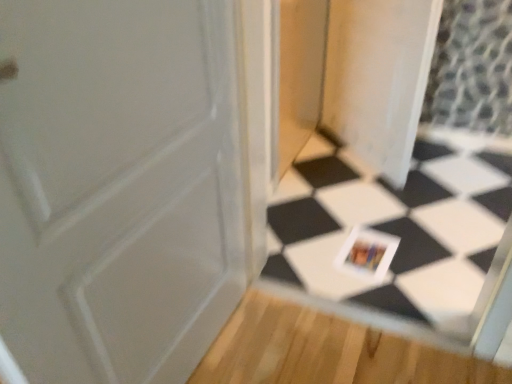
Question: Is transparent plastic screen door at center beside white glossy tile at center?

Choices:
 (A) yes
 (B) no

Answer: (B)

Question: Does transparent plastic screen door at center lie behind white glossy tile at center?

Choices:
 (A) no
 (B) yes

Answer: (B)

Question: Considering the relative sizes of transparent plastic screen door at center and white glossy tile at center in the image provided, is transparent plastic screen door at center wider than white glossy tile at center?

Choices:
 (A) yes
 (B) no

Answer: (B)

Question: Considering the relative sizes of transparent plastic screen door at center and white glossy tile at center in the image provided, is transparent plastic screen door at center thinner than white glossy tile at center?

Choices:
 (A) yes
 (B) no

Answer: (A)

Question: Is transparent plastic screen door at center positioned with its back to white glossy tile at center?

Choices:
 (A) no
 (B) yes

Answer: (A)

Question: Visually, is white glossy tile at center positioned to the left or to the right of transparent plastic screen door at center?

Choices:
 (A) left
 (B) right

Answer: (A)

Question: Is white glossy tile at center wider or thinner than transparent plastic screen door at center?

Choices:
 (A) wide
 (B) thin

Answer: (A)

Question: Is white glossy tile at center spatially inside transparent plastic screen door at center, or outside of it?

Choices:
 (A) outside
 (B) inside

Answer: (A)

Question: From a real-world perspective, relative to transparent plastic screen door at center, is white glossy tile at center vertically above or below?

Choices:
 (A) above
 (B) below

Answer: (A)

Question: In the image, is white glossy tile at center positioned in front of or behind white glossy postcard at center?

Choices:
 (A) behind
 (B) front

Answer: (B)

Question: Considering the positions of white glossy tile at center and white glossy postcard at center in the image, is white glossy tile at center taller or shorter than white glossy postcard at center?

Choices:
 (A) short
 (B) tall

Answer: (B)

Question: Looking at their shapes, would you say white glossy tile at center is wider or thinner than white glossy postcard at center?

Choices:
 (A) thin
 (B) wide

Answer: (A)

Question: Would you say white glossy tile at center is to the left or to the right of white glossy postcard at center in the picture?

Choices:
 (A) left
 (B) right

Answer: (A)

Question: From a real-world perspective, is transparent plastic screen door at center physically located above or below white glossy postcard at center?

Choices:
 (A) above
 (B) below

Answer: (A)

Question: Is point (399, 71) positioned closer to the camera than point (378, 268)?

Choices:
 (A) farther
 (B) closer

Answer: (A)